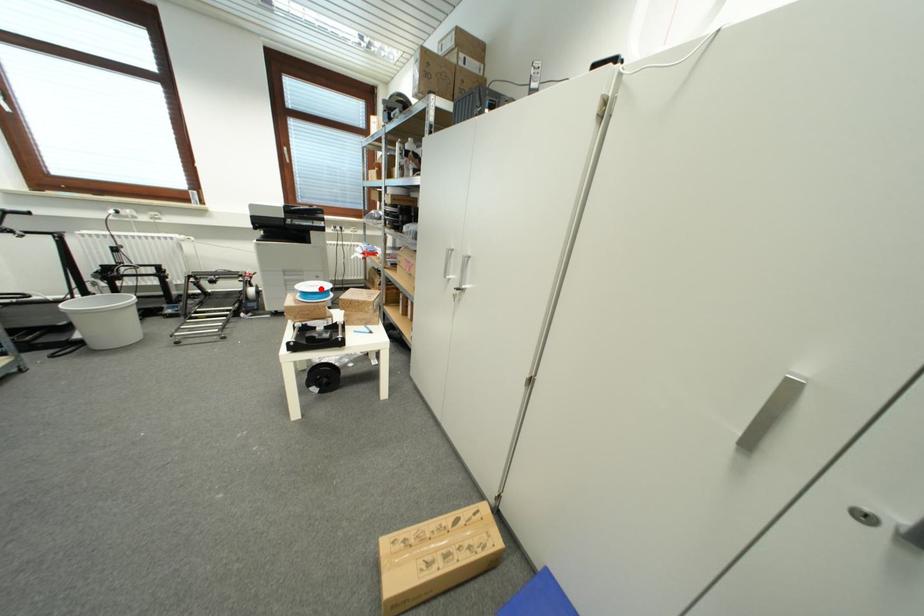
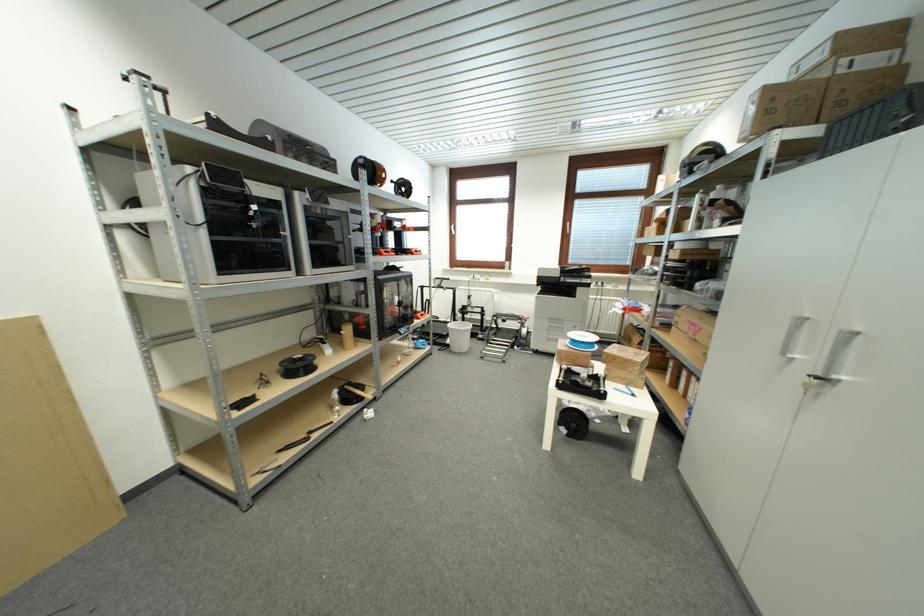
Question: I am providing you with two images of the same scene from different viewpoints. In image1, a red point is highlighted. Considering the same 3D point in image2, which of the following is correct?

Choices:
 (A) It is closer
 (B) It is farther

Answer: (A)